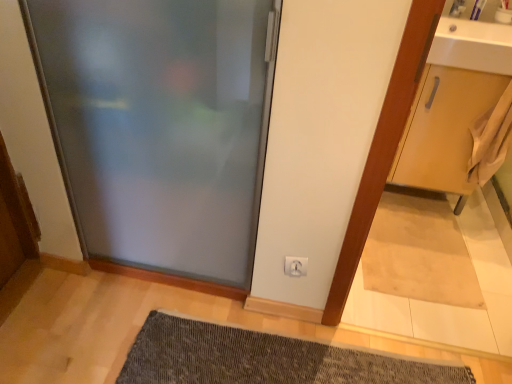
Question: In which direction should I rotate to look at white plastic electric outlet at lower center?

Choices:
 (A) right
 (B) left

Answer: (A)

Question: From the image's perspective, is white plastic electric outlet at lower center beneath dark gray textured bath mat at lower center?

Choices:
 (A) no
 (B) yes

Answer: (A)

Question: From the image's perspective, is white plastic electric outlet at lower center on dark gray textured bath mat at lower center?

Choices:
 (A) yes
 (B) no

Answer: (A)

Question: Can you confirm if white plastic electric outlet at lower center is thinner than dark gray textured bath mat at lower center?

Choices:
 (A) yes
 (B) no

Answer: (A)

Question: Is white plastic electric outlet at lower center outside of dark gray textured bath mat at lower center?

Choices:
 (A) yes
 (B) no

Answer: (A)

Question: Is white plastic electric outlet at lower center bigger than dark gray textured bath mat at lower center?

Choices:
 (A) no
 (B) yes

Answer: (A)

Question: Is dark gray textured bath mat at lower center inside white plastic electric outlet at lower center?

Choices:
 (A) yes
 (B) no

Answer: (B)

Question: Would you say beige fabric doormat at lower right is outside light brown wood cabinet at right?

Choices:
 (A) no
 (B) yes

Answer: (B)

Question: Is beige fabric doormat at lower right to the right of light brown wood cabinet at right from the viewer's perspective?

Choices:
 (A) yes
 (B) no

Answer: (B)

Question: From the image's perspective, is beige fabric doormat at lower right under light brown wood cabinet at right?

Choices:
 (A) yes
 (B) no

Answer: (A)

Question: From a real-world perspective, is beige fabric doormat at lower right physically below light brown wood cabinet at right?

Choices:
 (A) yes
 (B) no

Answer: (A)

Question: Is the position of beige fabric doormat at lower right more distant than that of light brown wood cabinet at right?

Choices:
 (A) no
 (B) yes

Answer: (B)

Question: Can you confirm if beige fabric doormat at lower right is bigger than light brown wood cabinet at right?

Choices:
 (A) no
 (B) yes

Answer: (A)

Question: Can you confirm if white plastic electric outlet at lower center is smaller than frosted glass door at center?

Choices:
 (A) yes
 (B) no

Answer: (A)